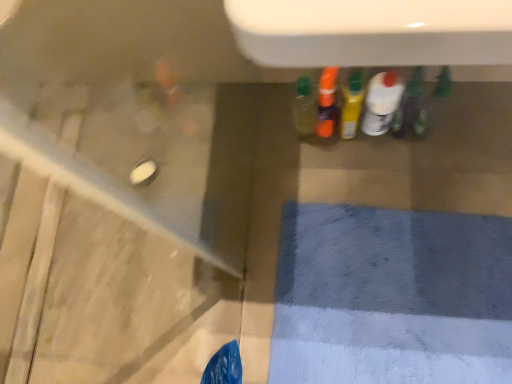
Where is `free location in front of translucent plastic bottle at center, arranged as the third bottle when viewed from the right`? This screenshot has height=384, width=512. free location in front of translucent plastic bottle at center, arranged as the third bottle when viewed from the right is located at coordinates (379, 168).